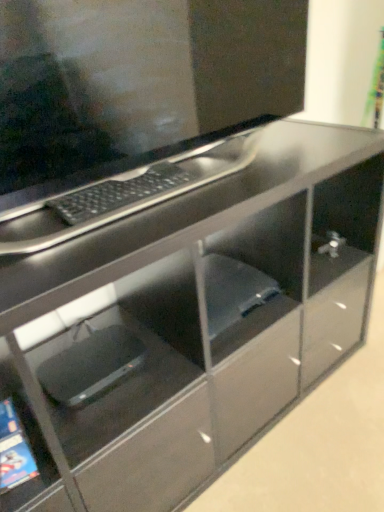
Question: Would you say black plastic laptop at lower left is to the left or to the right of matte black monitor at upper center in the picture?

Choices:
 (A) right
 (B) left

Answer: (B)

Question: Considering their positions, is black plastic laptop at lower left located in front of or behind matte black monitor at upper center?

Choices:
 (A) behind
 (B) front

Answer: (A)

Question: Which object is positioned farthest from the matte black monitor at upper center?

Choices:
 (A) black plastic laptop at lower left
 (B) black matte keyboard at upper center

Answer: (A)

Question: Based on their relative distances, which object is nearer to the matte black monitor at upper center?

Choices:
 (A) black matte keyboard at upper center
 (B) black plastic laptop at lower left

Answer: (A)